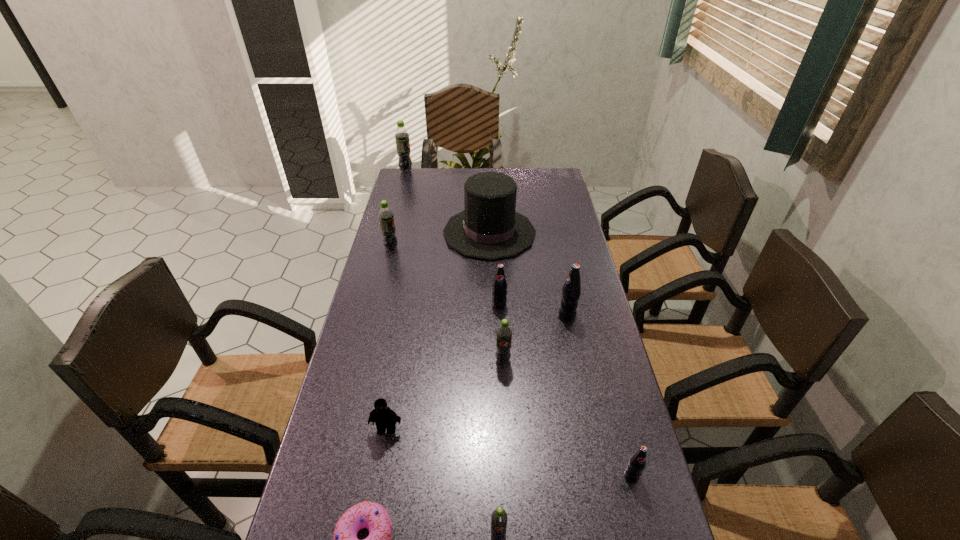
Locate an element on the screen. the rightmost black pop is located at coordinates (637, 462).

Locate an element on the screen. the smallest black pop is located at coordinates (637, 462).

Where is `Lego`? Image resolution: width=960 pixels, height=540 pixels. Lego is located at coordinates (385, 418).

Image resolution: width=960 pixels, height=540 pixels. What are the coordinates of `black Lego` in the screenshot? It's located at (385, 418).

The width and height of the screenshot is (960, 540). Find the location of `free space located 0.230m on the front label of the farthest green soda`. free space located 0.230m on the front label of the farthest green soda is located at coordinates (464, 171).

At what (x,y) coordinates should I click in order to perform the action: click on free space located 0.230m on the front of the dress hat with the decoration. Please return your answer as a coordinate pair (x, y). The width and height of the screenshot is (960, 540). Looking at the image, I should click on (382, 233).

Find the location of a particular element. free space located 0.120m on the front of the dress hat with the decoration is located at coordinates (411, 233).

You are a GUI agent. You are given a task and a screenshot of the screen. Output one action in this format:
    pyautogui.click(x=<x>, y=<y>)
    Task: Click on the free space located on the front of the dress hat with the decoration
    This screenshot has width=960, height=540.
    Given the screenshot: What is the action you would take?
    pyautogui.click(x=400, y=233)

Where is `vacant space located on the front label of the third nearest green soda`? This screenshot has height=540, width=960. vacant space located on the front label of the third nearest green soda is located at coordinates (438, 248).

Find the location of a particular element. free space located 0.270m on the front label of the biggest black pop is located at coordinates (468, 316).